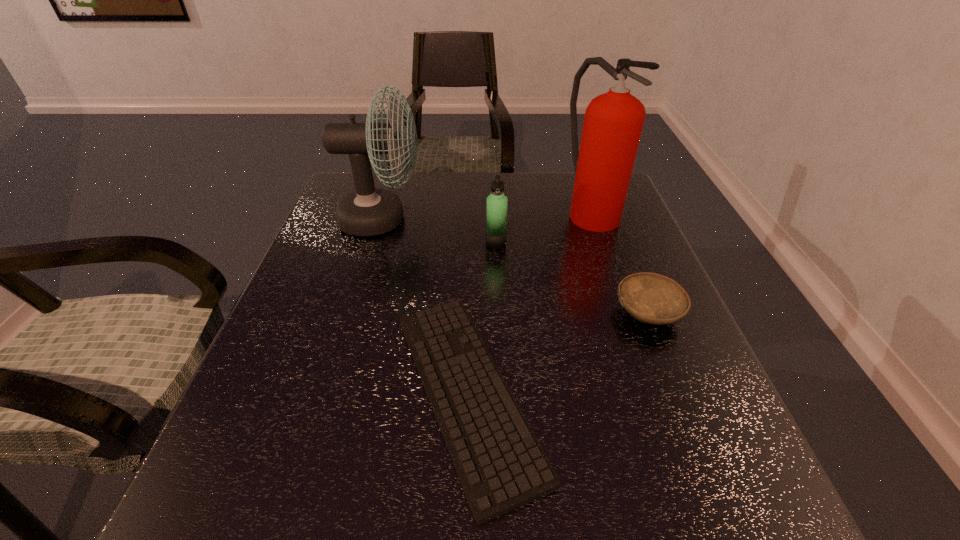
Locate an element on the screen. fire extinguisher that is at the far edge is located at coordinates (613, 122).

Image resolution: width=960 pixels, height=540 pixels. I want to click on fan that is at the far edge, so click(369, 211).

Identify the location of object located in the near edge section of the desktop. (501, 466).

Image resolution: width=960 pixels, height=540 pixels. I want to click on object that is at the left edge, so click(x=369, y=211).

At what (x,y) coordinates should I click in order to perform the action: click on fire extinguisher present at the right edge. Please return your answer as a coordinate pair (x, y). Looking at the image, I should click on (613, 122).

Where is `bowl that is at the right edge`? This screenshot has height=540, width=960. bowl that is at the right edge is located at coordinates (650, 298).

At what (x,y) coordinates should I click in order to perform the action: click on object located in the far left corner section of the desktop. Please return your answer as a coordinate pair (x, y). Image resolution: width=960 pixels, height=540 pixels. Looking at the image, I should click on (369, 211).

This screenshot has width=960, height=540. Find the location of `object that is at the far right corner`. object that is at the far right corner is located at coordinates (613, 122).

You are a GUI agent. You are given a task and a screenshot of the screen. Output one action in this format:
    pyautogui.click(x=<x>, y=<y>)
    Task: Click on the free space at the far edge
    
    Given the screenshot: What is the action you would take?
    pyautogui.click(x=566, y=188)

In the image, there is a desktop. Where is `free region at the left edge`? This screenshot has height=540, width=960. free region at the left edge is located at coordinates (329, 280).